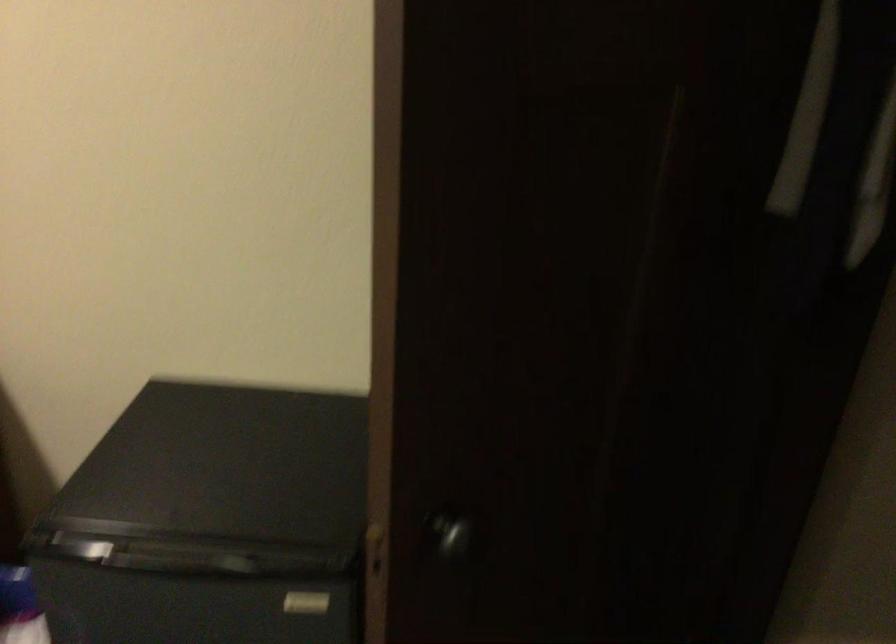
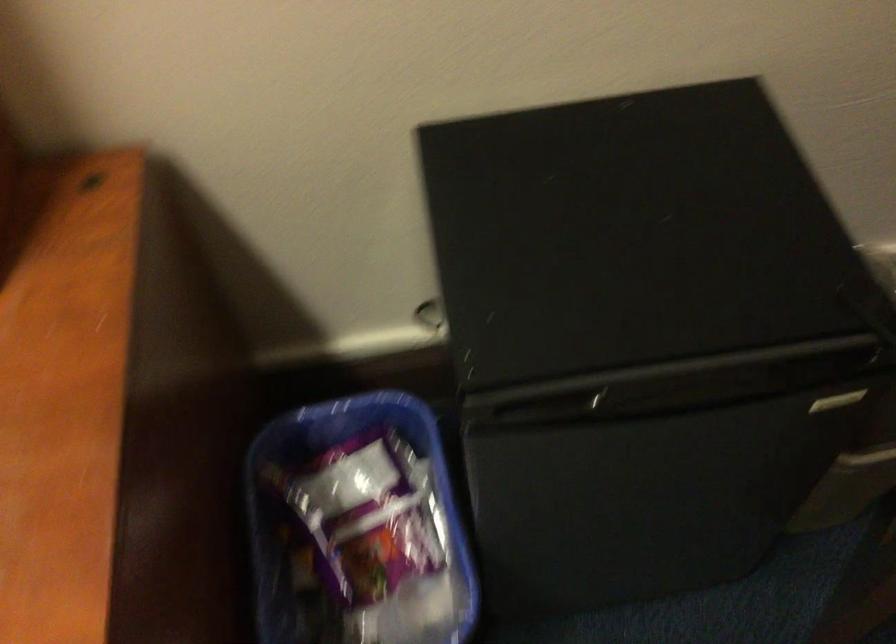
Question: The images are taken continuously from a first-person perspective. In which direction is your viewpoint rotating?

Choices:
 (A) Left
 (B) Right
 (C) Up
 (D) Down

Answer: (D)